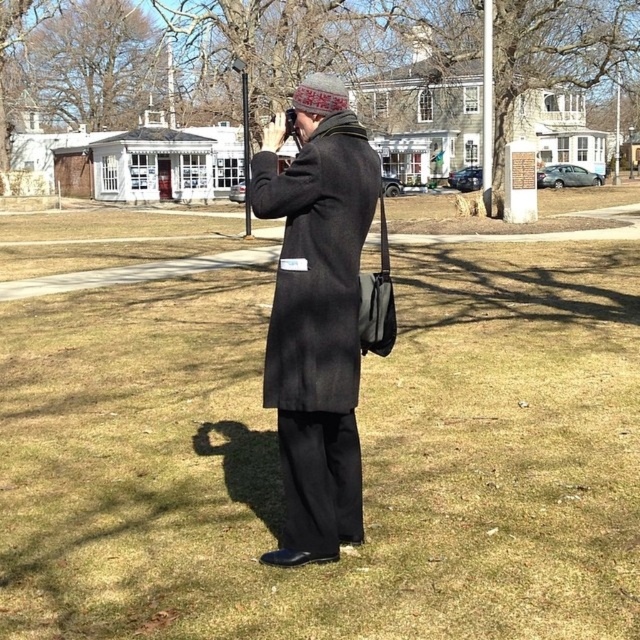
Question: Which point is farther to the camera?

Choices:
 (A) (273, 364)
 (B) (86, 544)

Answer: (B)

Question: Where is green grass at center located in relation to matte black coat at center in the image?

Choices:
 (A) above
 (B) below

Answer: (B)

Question: Which point is farther to the camera?

Choices:
 (A) green grass at center
 (B) matte black coat at center

Answer: (B)

Question: Is green grass at center to the right of matte black coat at center from the viewer's perspective?

Choices:
 (A) yes
 (B) no

Answer: (B)

Question: Which point is farther to the camera?

Choices:
 (A) (576, 316)
 (B) (358, 198)

Answer: (A)

Question: Does green grass at center have a larger size compared to matte black coat at center?

Choices:
 (A) no
 (B) yes

Answer: (B)